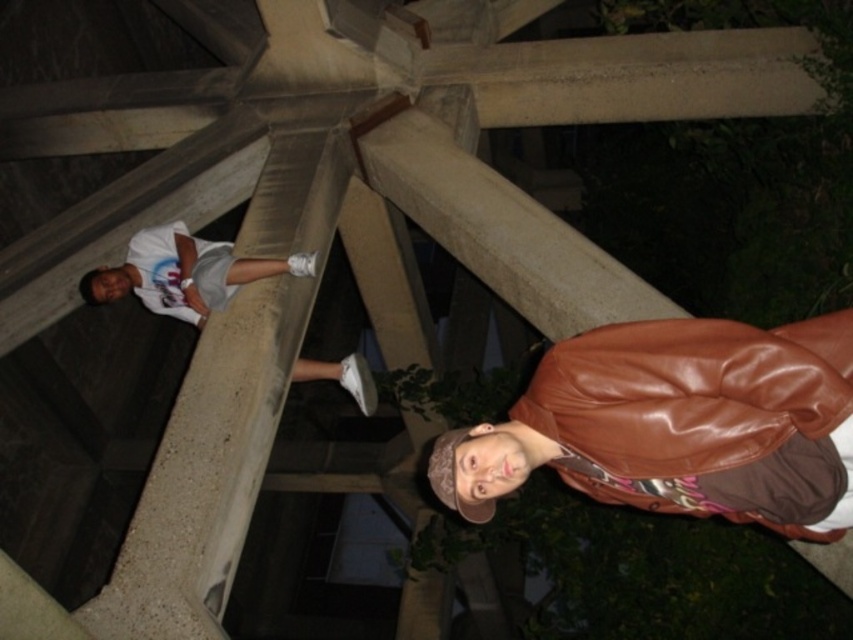
You are standing at the point with coordinates point (177, 244) and want to walk towards the point with coordinates point (548, 416). Based on the scene description, will the concrete structure block your path?

Point (548, 416) is in front of point (177, 244), so the concrete structure will not block your path as you walk towards it.